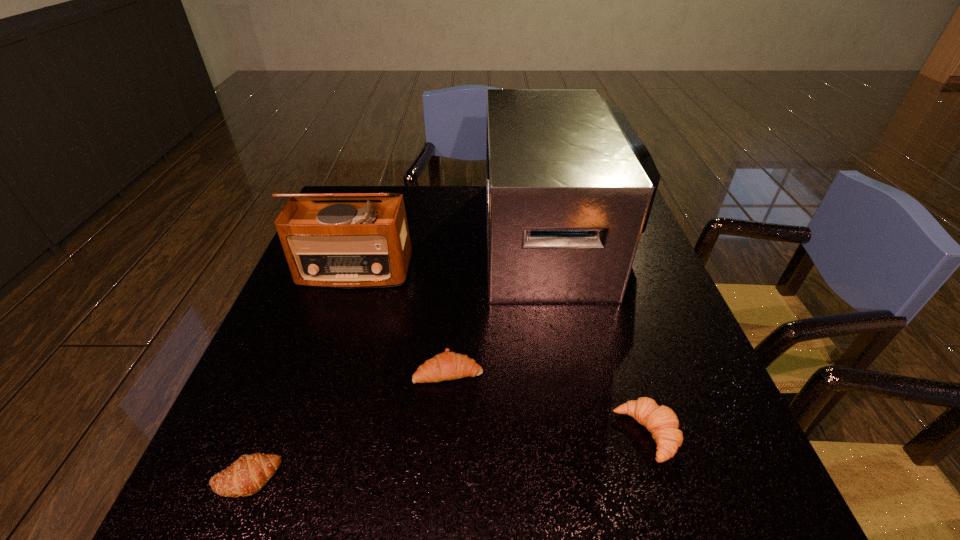
Identify the location of the tallest object. click(570, 186).

You are a GUI agent. You are given a task and a screenshot of the screen. Output one action in this format:
    pyautogui.click(x=<x>, y=<y>)
    Task: Click on the radio receiver
    
    Given the screenshot: What is the action you would take?
    pyautogui.click(x=350, y=244)

Find the location of a particular element. the rightmost crescent roll is located at coordinates (661, 421).

The width and height of the screenshot is (960, 540). I want to click on the leftmost crescent roll, so click(x=246, y=476).

You are a GUI agent. You are given a task and a screenshot of the screen. Output one action in this format:
    pyautogui.click(x=<x>, y=<y>)
    Task: Click on the third object from right to left
    This screenshot has width=960, height=540.
    Given the screenshot: What is the action you would take?
    pos(448,365)

Where is `the third nearest object`? The image size is (960, 540). the third nearest object is located at coordinates (448, 365).

Where is `blank area located 0.180m on the front-facing side of the microwave oven`? The width and height of the screenshot is (960, 540). blank area located 0.180m on the front-facing side of the microwave oven is located at coordinates (424, 235).

Find the location of a particular element. free space located 0.340m on the front-facing side of the microwave oven is located at coordinates point(368,235).

Image resolution: width=960 pixels, height=540 pixels. I want to click on vacant space located on the front-facing side of the microwave oven, so click(452, 235).

Find the location of a particular element. This screenshot has height=540, width=960. vacant space situated 0.120m on the front panel of the second tallest object is located at coordinates (336, 326).